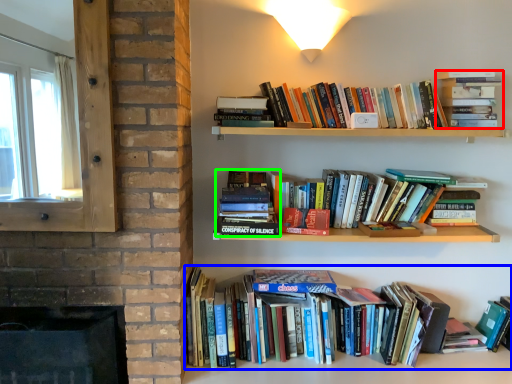
Question: Which object is positioned farthest from book (highlighted by a red box)? Select from book (highlighted by a blue box) and book (highlighted by a green box).

Choices:
 (A) book
 (B) book

Answer: (A)